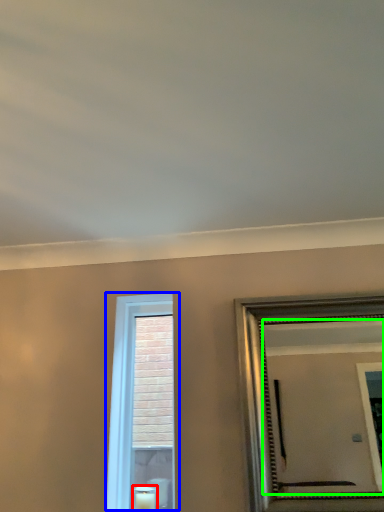
Question: Considering the real-world distances, which object is closest to candle (highlighted by a red box)? window (highlighted by a blue box) or mirror (highlighted by a green box).

Choices:
 (A) window
 (B) mirror

Answer: (A)